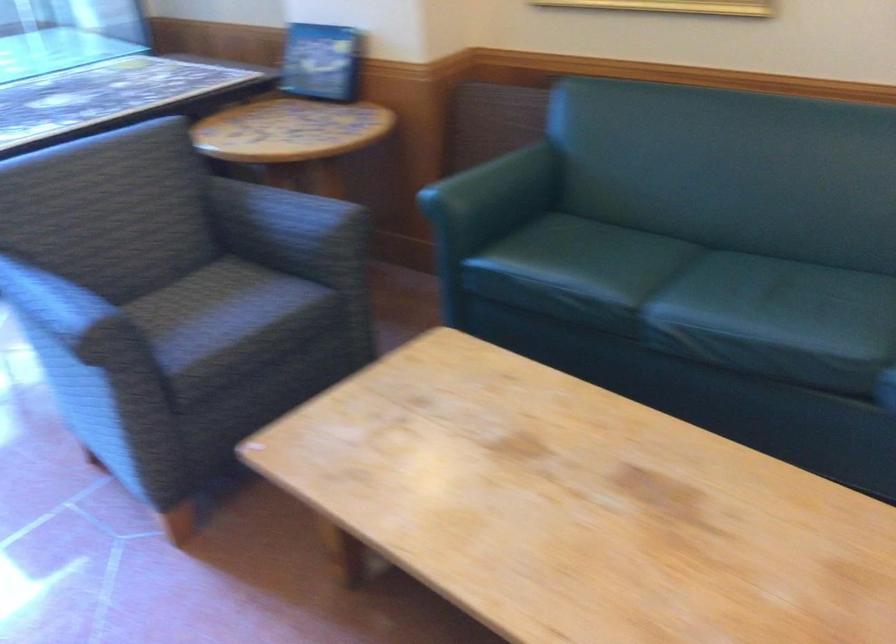
What do you see at coordinates (496, 182) in the screenshot? The image size is (896, 644). I see `a green sofa armrest` at bounding box center [496, 182].